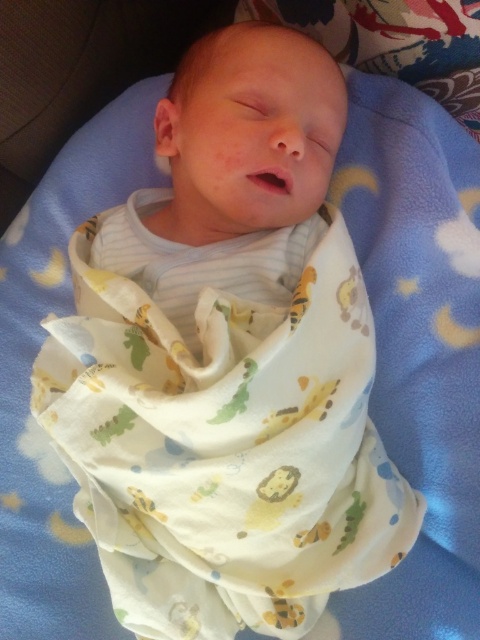
Question: Does white fabric with animal prints at center appear on the right side of white soft swaddle at center?

Choices:
 (A) no
 (B) yes

Answer: (A)

Question: Does white fabric with animal prints at center come in front of white soft swaddle at center?

Choices:
 (A) yes
 (B) no

Answer: (A)

Question: Among these objects, which one is nearest to the camera?

Choices:
 (A) white soft swaddle at center
 (B) white fabric with animal prints at center

Answer: (B)

Question: Can you confirm if white fabric with animal prints at center is thinner than white soft swaddle at center?

Choices:
 (A) yes
 (B) no

Answer: (B)

Question: Which object appears closest to the camera in this image?

Choices:
 (A) white fabric with animal prints at center
 (B) white soft swaddle at center

Answer: (A)